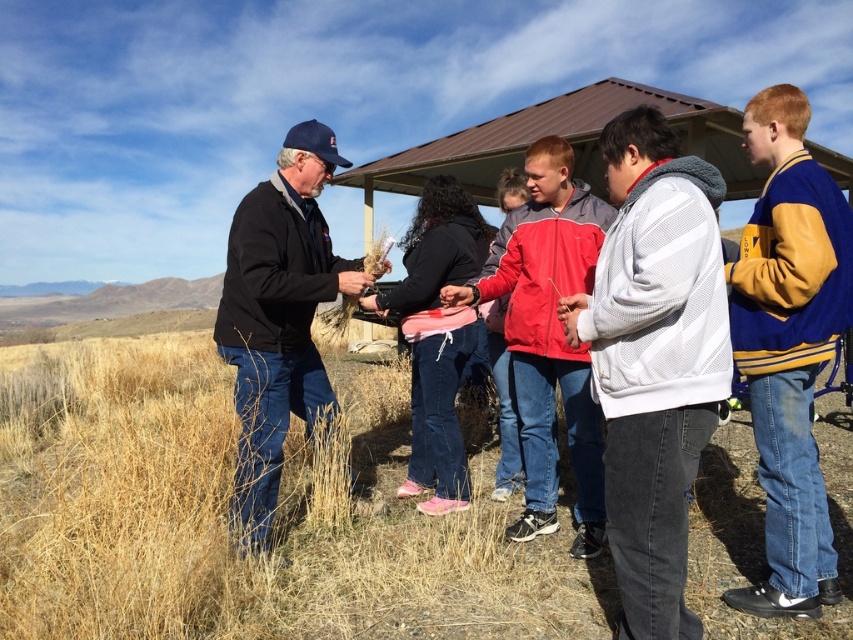
You are standing at the center of the image and want to place a small marker at point (654, 358). What object will the marker hit?

The marker will hit the white mesh jacket at center located at point (654, 358).

You are standing in the rural area shown in the image. There are two points marked in the scene. The first point is at coordinates point (x=833, y=280) and the second point is at point (x=540, y=456). Which point is closer to you?

Point (x=833, y=280) is closer to the viewer than point (x=540, y=456).